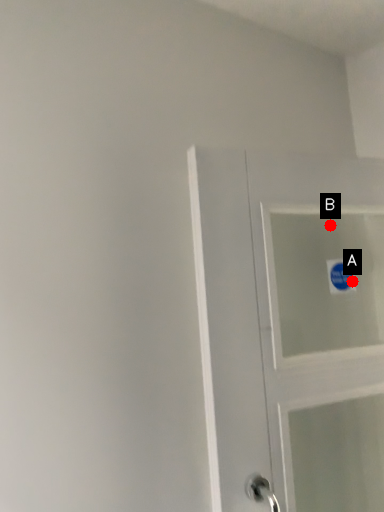
Question: Two points are circled on the image, labeled by A and B beside each circle. Which of the following is the closest to the observer?

Choices:
 (A) A is closer
 (B) B is closer

Answer: (B)